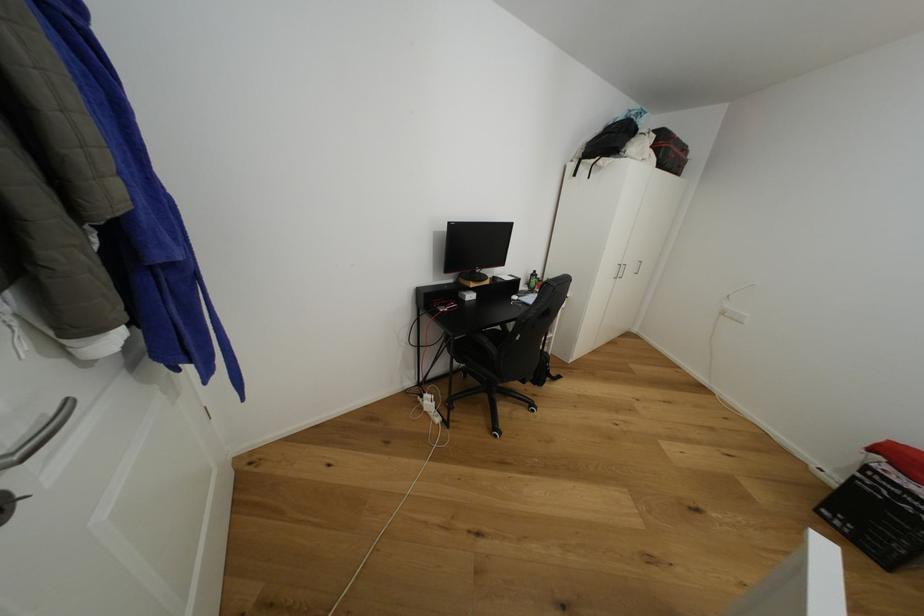
Image resolution: width=924 pixels, height=616 pixels. I want to click on silver door handle, so click(x=40, y=435).